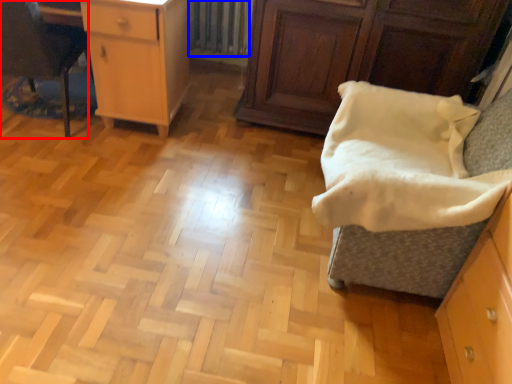
Question: Which of the following is the closest to the observer, furniture (highlighted by a red box) or radiator (highlighted by a blue box)?

Choices:
 (A) furniture
 (B) radiator

Answer: (A)